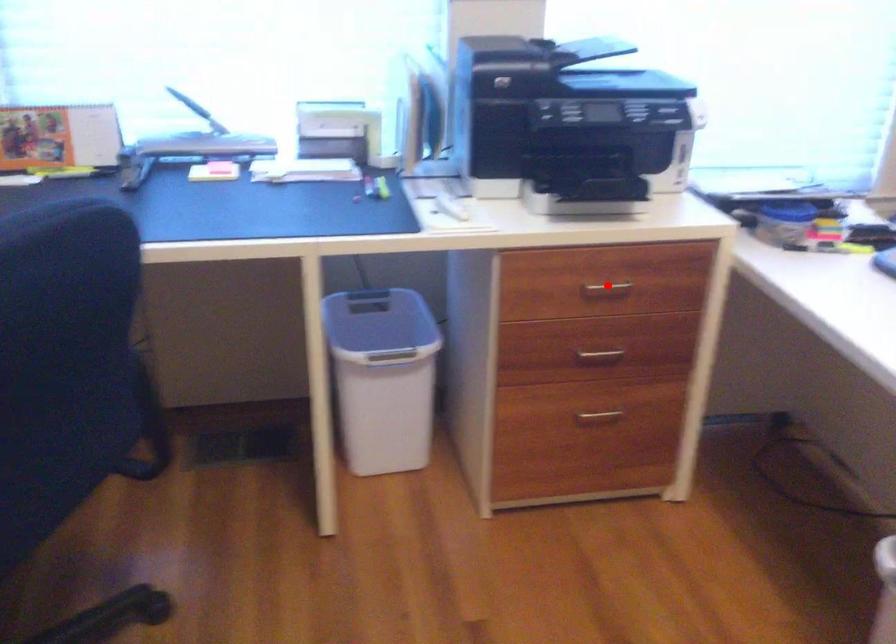
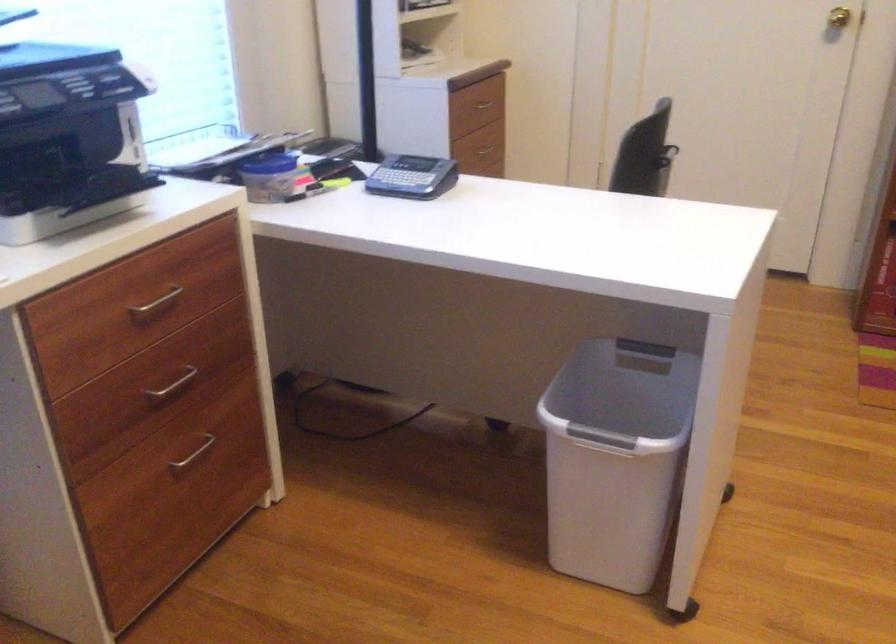
Find the pixel in the second image that matches the highlighted location in the first image.

(156, 303)